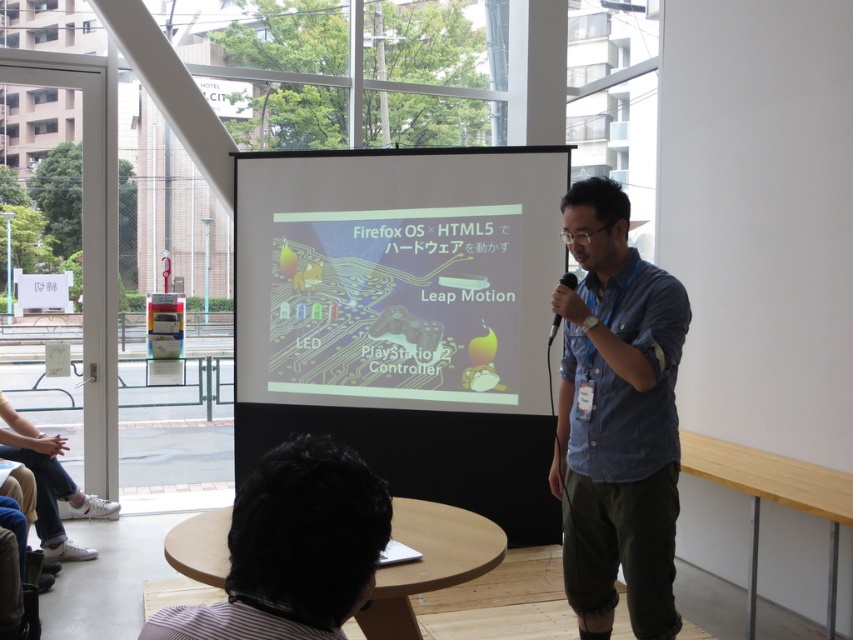
Question: Is blue denim shirt at center thinner than black striped shirt at lower left?

Choices:
 (A) no
 (B) yes

Answer: (A)

Question: Does blue denim shirt at center appear on the right side of black matte microphone at center?

Choices:
 (A) yes
 (B) no

Answer: (A)

Question: Which object is the closest to the blue denim shirt at center?

Choices:
 (A) black matte microphone at center
 (B) white glossy projector screen at center

Answer: (A)

Question: Which point appears closest to the camera in this image?

Choices:
 (A) (648, 282)
 (B) (573, 276)

Answer: (A)

Question: Can you confirm if white glossy projector screen at center is positioned above black matte microphone at center?

Choices:
 (A) yes
 (B) no

Answer: (A)

Question: Which object is positioned closest to the white glossy projector screen at center?

Choices:
 (A) black striped shirt at lower left
 (B) black matte microphone at center
 (C) blue denim shirt at center

Answer: (B)